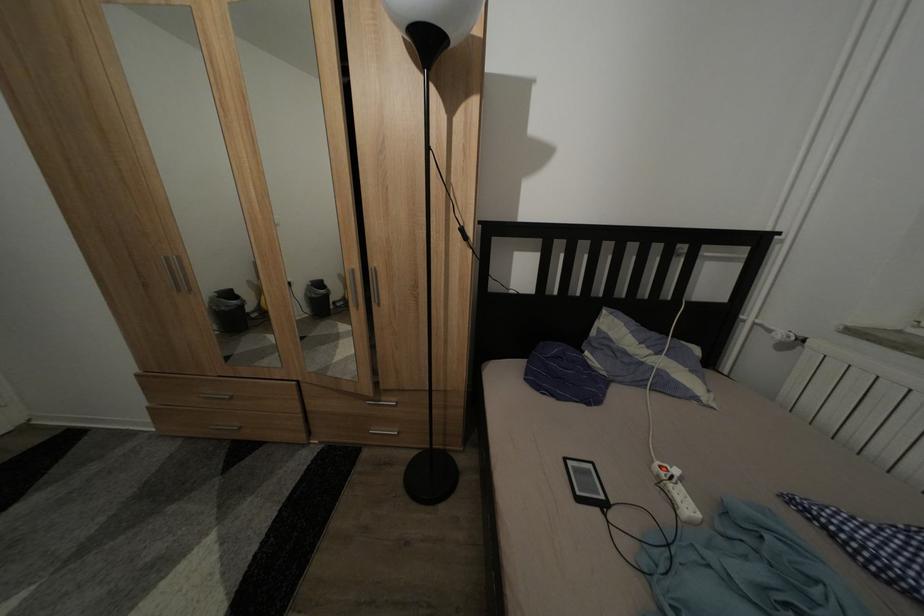
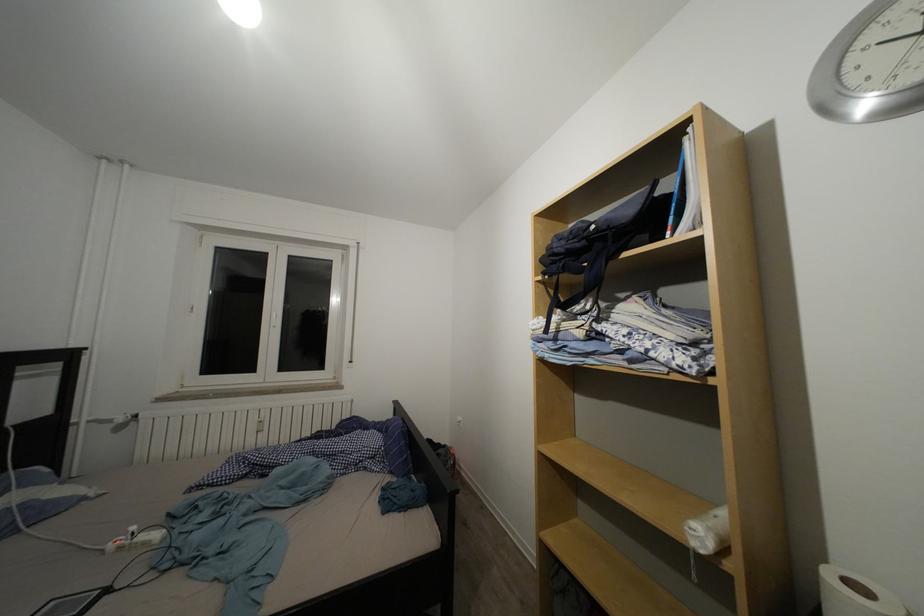
Where in the second image is the point corresponding to (684,477) from the first image?

(140, 533)